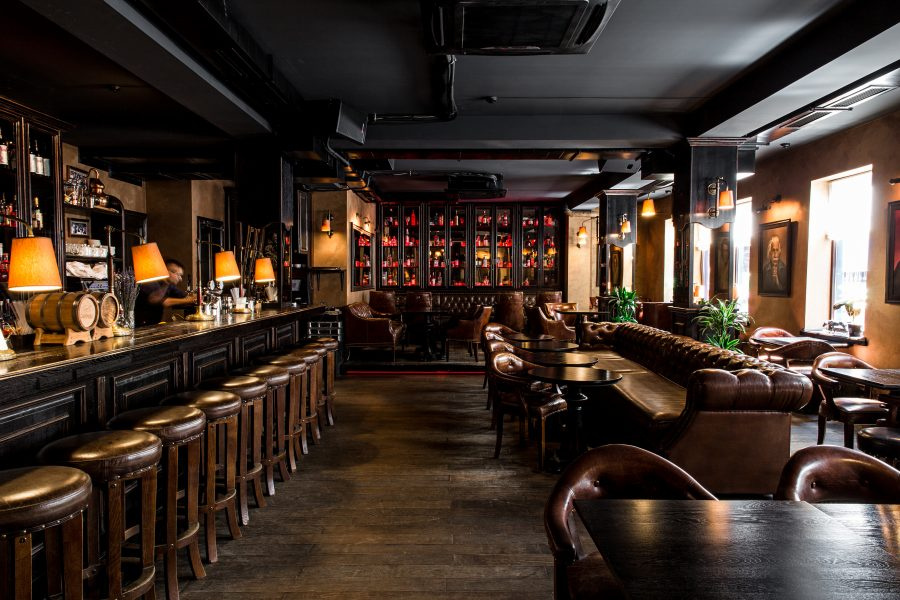
Find the location of `small orange lamps`. small orange lamps is located at coordinates (150, 269), (30, 272), (219, 272), (273, 271).